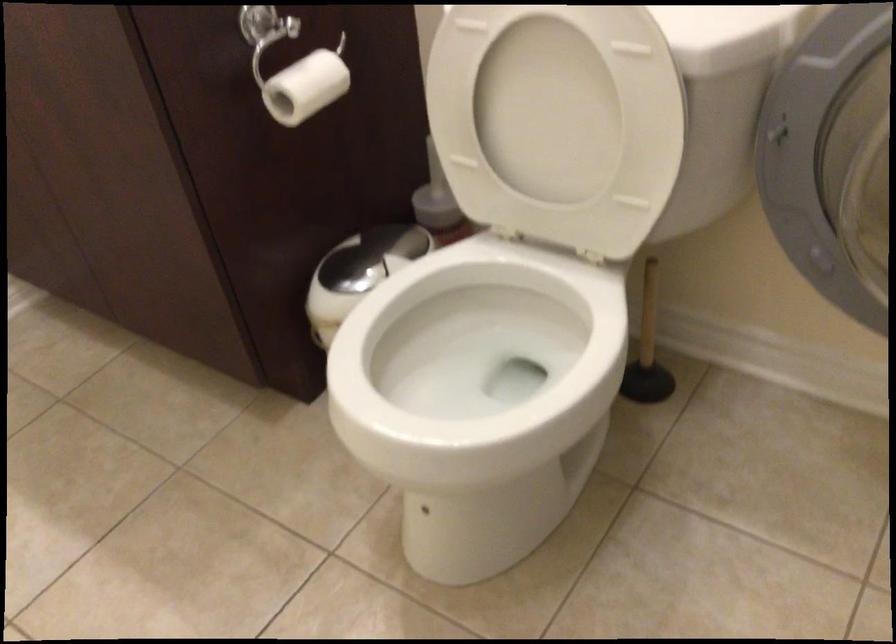
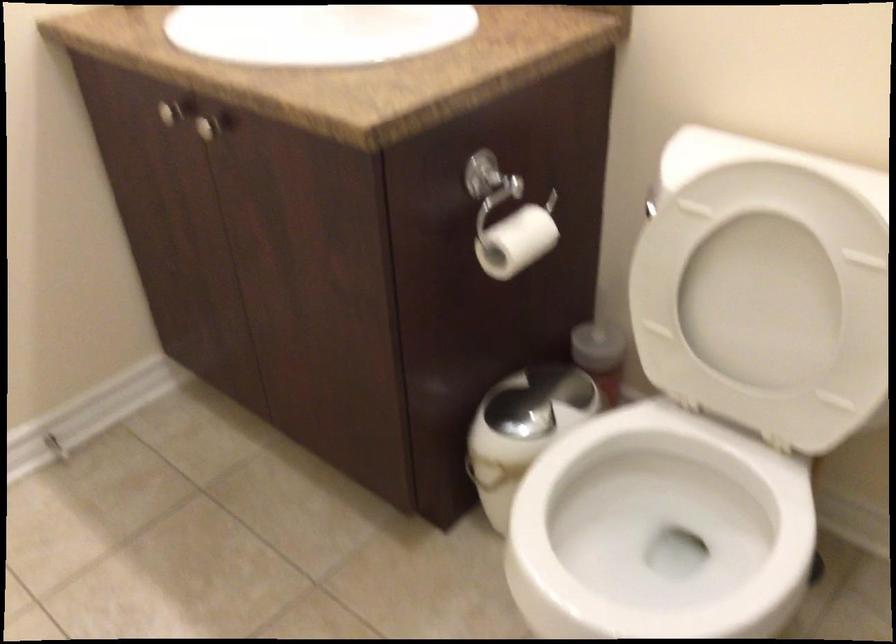
The point at (x=502, y=364) is marked in the first image. Where is the corresponding point in the second image?

(660, 524)